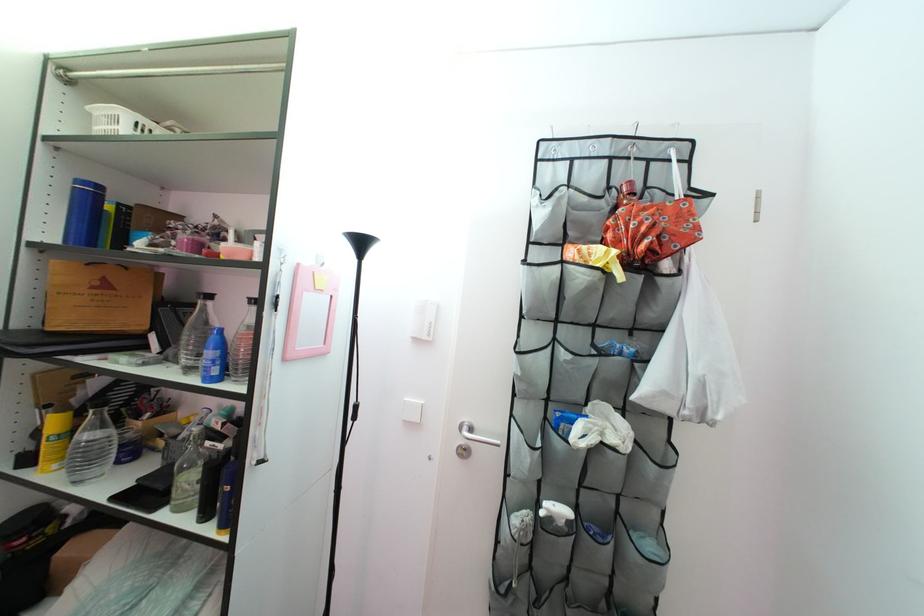
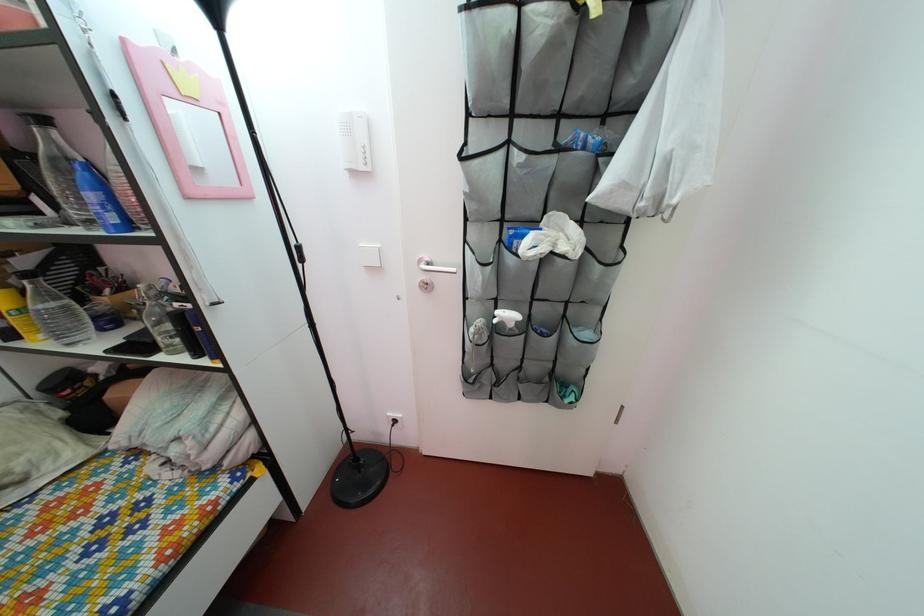
The point at (175,354) is marked in the first image. Where is the corresponding point in the second image?

(68, 217)